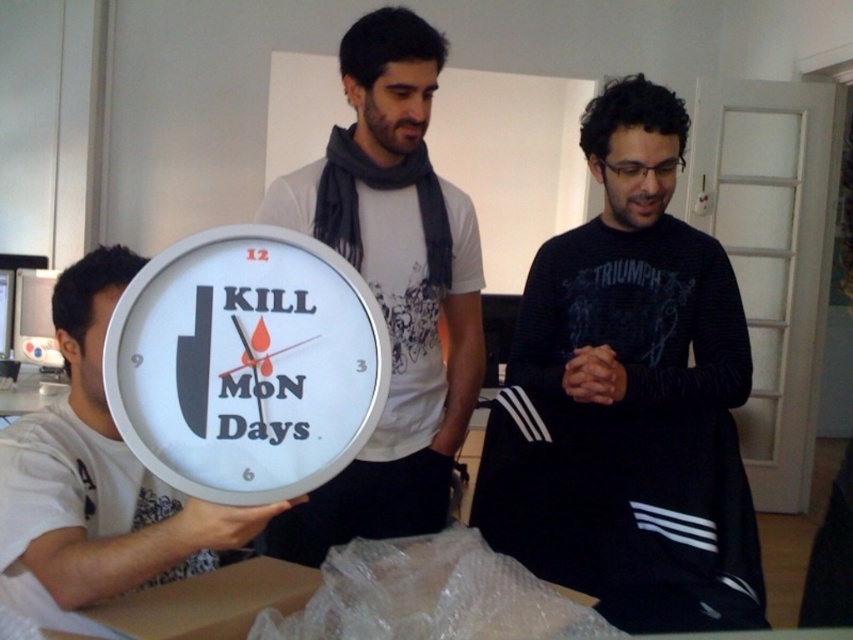
Consider the image. Based on the scene description, where is the white matte clock at center located in terms of its 2D coordinates?

The white matte clock at center is located at the 2D coordinates point (x=392, y=288).

You are standing in the room where the gathering is happening. You want to take a photo of the black matte sweater at center and the white matte clock at center. Which object should you focus on first to ensure both are in focus?

You should focus on the black matte sweater at center first because it is closer to the viewer than the white matte clock at center. By focusing on the closer object, the depth of field may still capture the white matte clock at center in focus as well.

You are organizing a party and need to choose between the white glossy clock at center and the white matte clock at center for your wall. Which one would you pick if you want the clock to be narrower?

The white glossy clock at center has a lesser width compared to white matte clock at center, so you should choose the white glossy clock at center if you want the clock to be narrower.